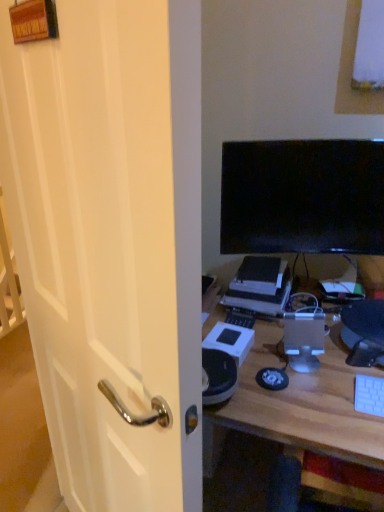
Question: Is white wood desk at center positioned in front of satin silver computer tower at center?

Choices:
 (A) no
 (B) yes

Answer: (B)

Question: Considering the relative sizes of white wood desk at center and satin silver computer tower at center in the image provided, is white wood desk at center wider than satin silver computer tower at center?

Choices:
 (A) no
 (B) yes

Answer: (B)

Question: Is white wood desk at center smaller than satin silver computer tower at center?

Choices:
 (A) yes
 (B) no

Answer: (B)

Question: From the image's perspective, would you say white wood desk at center is shown under satin silver computer tower at center?

Choices:
 (A) yes
 (B) no

Answer: (A)

Question: From the image's perspective, is white wood desk at center above satin silver computer tower at center?

Choices:
 (A) no
 (B) yes

Answer: (A)

Question: From the image's perspective, is black plastic printer at center above or below white plastic keyboard at lower right?

Choices:
 (A) below
 (B) above

Answer: (B)

Question: In the image, is black plastic printer at center on the left side or the right side of white plastic keyboard at lower right?

Choices:
 (A) left
 (B) right

Answer: (A)

Question: Is black plastic printer at center bigger or smaller than white plastic keyboard at lower right?

Choices:
 (A) small
 (B) big

Answer: (B)

Question: Is black plastic printer at center inside the boundaries of white plastic keyboard at lower right, or outside?

Choices:
 (A) outside
 (B) inside

Answer: (A)

Question: From the image's perspective, is satin silver computer tower at center above or below black plastic printer at center?

Choices:
 (A) above
 (B) below

Answer: (B)

Question: Would you say satin silver computer tower at center is to the left or to the right of black plastic printer at center in the picture?

Choices:
 (A) right
 (B) left

Answer: (A)

Question: Do you think satin silver computer tower at center is within black plastic printer at center, or outside of it?

Choices:
 (A) inside
 (B) outside

Answer: (B)

Question: Is satin silver computer tower at center taller or shorter than black plastic printer at center?

Choices:
 (A) short
 (B) tall

Answer: (B)

Question: Visually, is black glossy screen at upper right positioned to the left or to the right of satin silver computer tower at center?

Choices:
 (A) right
 (B) left

Answer: (A)

Question: Is black glossy screen at upper right inside or outside of satin silver computer tower at center?

Choices:
 (A) inside
 (B) outside

Answer: (B)